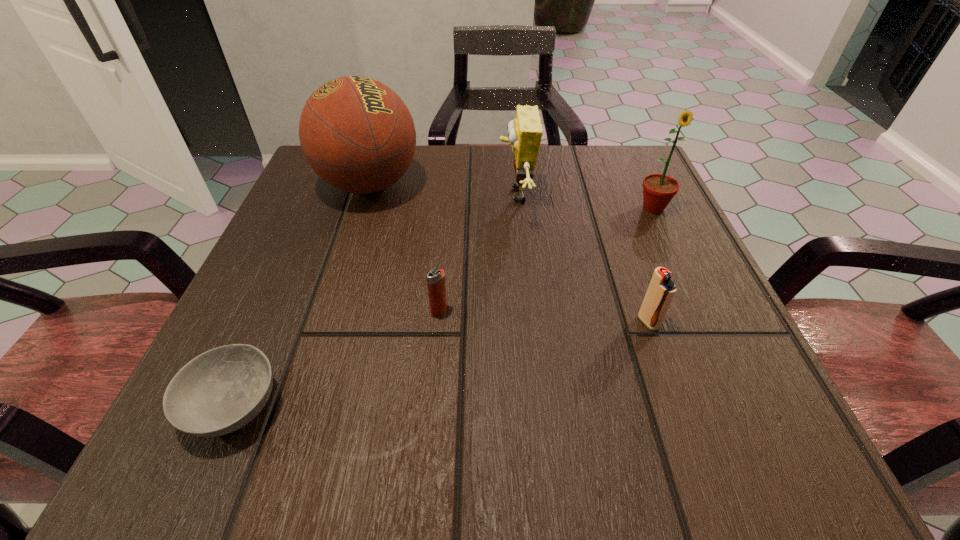
What are the coordinates of `blank region between the bowl and the fourth object from left to right` in the screenshot? It's located at (374, 300).

Locate an element on the screen. free space between the left igniter and the rightmost object is located at coordinates (546, 259).

What are the coordinates of `empty space between the left igniter and the rightmost object` in the screenshot? It's located at (546, 259).

What are the coordinates of `vacant area between the left igniter and the sunflower` in the screenshot? It's located at (546, 259).

Identify which object is the closest to the second object from right to left. Please provide its 2D coordinates. Your answer should be formatted as a tuple, i.e. [(x, y)], where the tuple contains the x and y coordinates of a point satisfying the conditions above.

[(525, 132)]

Identify which object is the closest to the basketball. Please provide its 2D coordinates. Your answer should be formatted as a tuple, i.e. [(x, y)], where the tuple contains the x and y coordinates of a point satisfying the conditions above.

[(525, 132)]

Where is `free space that satisfies the following two spatial constraints: 1. on the face of the fourth shortest object; 2. on the front side of the bowl`? free space that satisfies the following two spatial constraints: 1. on the face of the fourth shortest object; 2. on the front side of the bowl is located at coordinates (536, 405).